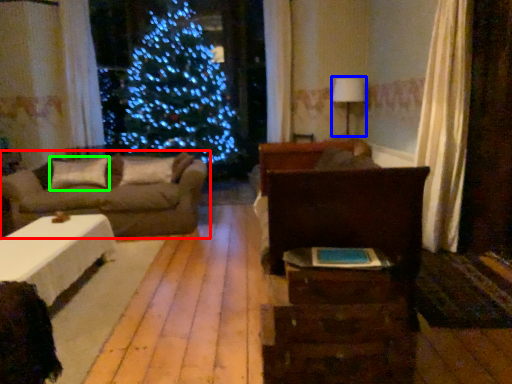
Question: Estimate the real-world distances between objects in this image. Which object is closer to studio couch (highlighted by a red box), lamp (highlighted by a blue box) or pillow (highlighted by a green box)?

Choices:
 (A) lamp
 (B) pillow

Answer: (B)